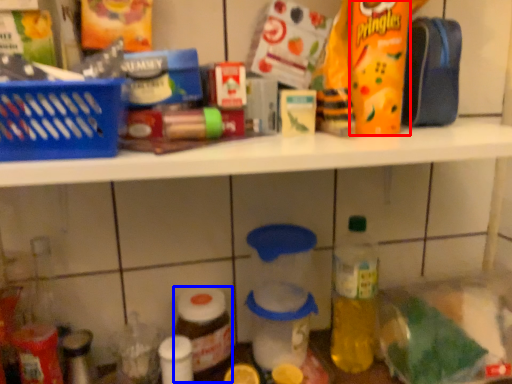
Question: Which object is further to the camera taking this photo, snack (highlighted by a red box) or bottle (highlighted by a blue box)?

Choices:
 (A) snack
 (B) bottle

Answer: (B)